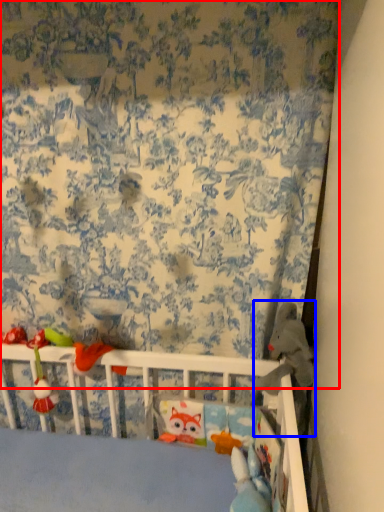
Question: Among these objects, which one is nearest to the camera, curtain (highlighted by a red box) or toy (highlighted by a blue box)?

Choices:
 (A) curtain
 (B) toy

Answer: (A)